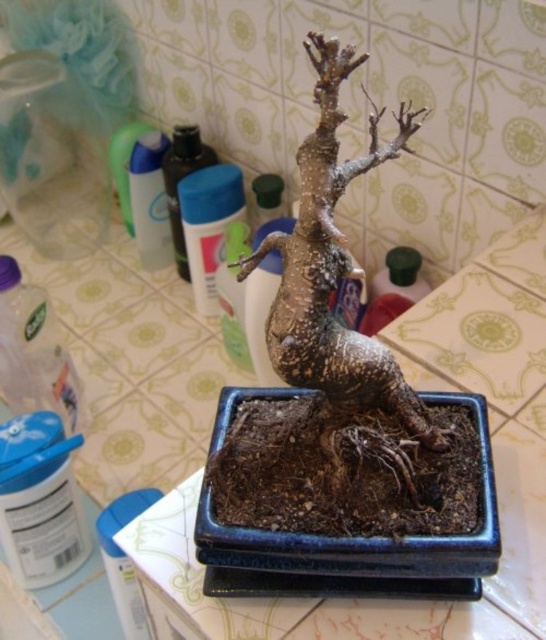
You are organizing a shelf and need to place the clear plastic bottle at lower left and the translucent plastic bottle at upper left. Which bottle should you place on the lower shelf if you want the taller bottle to be on the upper shelf?

The translucent plastic bottle at upper left is taller than the clear plastic bottle at lower left, so you should place the translucent plastic bottle at upper left on the upper shelf and the clear plastic bottle at lower left on the lower shelf.